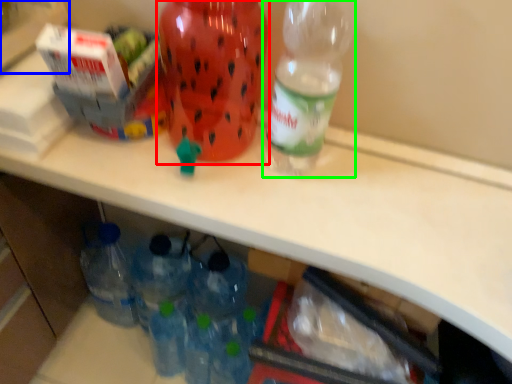
Question: Which object is the farthest from bottle (highlighted by a red box)? Choose among these: box (highlighted by a blue box) or bottle (highlighted by a green box).

Choices:
 (A) box
 (B) bottle

Answer: (A)